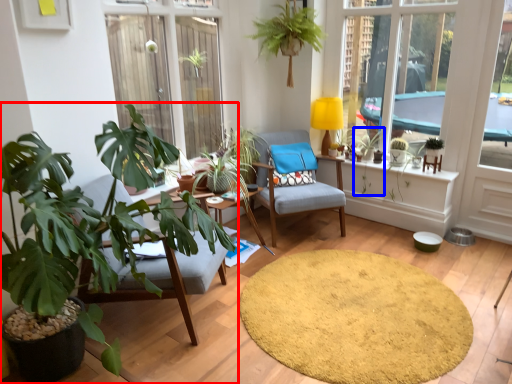
Question: Among these objects, which one is nearest to the camera, houseplant (highlighted by a red box) or plant (highlighted by a blue box)?

Choices:
 (A) houseplant
 (B) plant

Answer: (A)